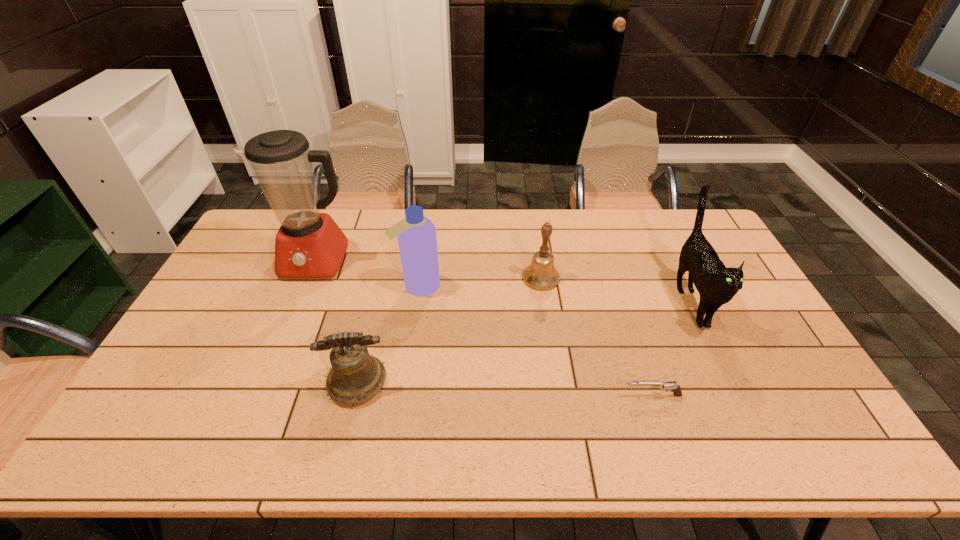
This screenshot has height=540, width=960. In order to click on object that is at the right edge in this screenshot , I will do `click(717, 285)`.

I want to click on object that is at the far left corner, so click(x=309, y=244).

In the image, there is a desktop. Identify the location of blank space at the far edge. This screenshot has width=960, height=540. (588, 231).

Find the location of a particular element. Image resolution: width=960 pixels, height=540 pixels. vacant area at the near edge of the desktop is located at coordinates (625, 459).

In the image, there is a desktop. Where is `vacant space at the right edge`? The image size is (960, 540). vacant space at the right edge is located at coordinates (755, 355).

Locate an element on the screen. The image size is (960, 540). free region at the near left corner is located at coordinates (177, 447).

Identify the location of vacant area at the far right corner of the desktop. This screenshot has width=960, height=540. (691, 217).

At what (x,y) coordinates should I click in order to perform the action: click on vacant area that lies between the blender and the nearer bell. Please return your answer as a coordinate pair (x, y). Looking at the image, I should click on (337, 321).

You are a GUI agent. You are given a task and a screenshot of the screen. Output one action in this format:
    pyautogui.click(x=<x>, y=<y>)
    Task: Click on the vacant space that's between the shampoo and the pistol
    Image resolution: width=960 pixels, height=540 pixels.
    Given the screenshot: What is the action you would take?
    pyautogui.click(x=536, y=341)

This screenshot has width=960, height=540. Find the location of `free space between the rightmost object and the blender`. free space between the rightmost object and the blender is located at coordinates (503, 281).